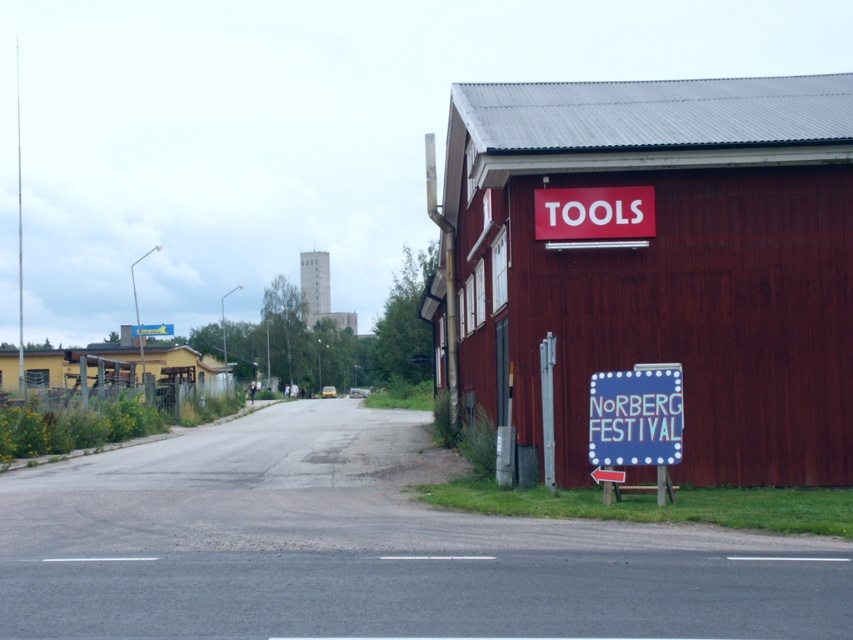
Does yellow wood barn at left have a smaller size compared to blue fabric sign at lower right?

No.

Which of these two, yellow wood barn at left or blue fabric sign at lower right, stands shorter?

With less height is blue fabric sign at lower right.

Does point (196, 360) come farther from viewer compared to point (602, 445)?

That is True.

What are the coordinates of `yellow wood barn at left` in the screenshot? It's located at (129, 372).

Does blue fabric sign at lower right have a lesser width compared to red matte tools at upper right?

Correct, blue fabric sign at lower right's width is less than red matte tools at upper right's.

Can you confirm if blue fabric sign at lower right is smaller than red matte tools at upper right?

No.

Which is in front, point (630, 429) or point (646, 221)?

Point (630, 429) is more forward.

Image resolution: width=853 pixels, height=640 pixels. Find the location of `blue fabric sign at lower right`. blue fabric sign at lower right is located at coordinates (637, 419).

Which is more to the left, red wood barn at right or red matte tools at upper right?

red wood barn at right is more to the left.

Is red wood barn at right above red matte tools at upper right?

Indeed, red wood barn at right is positioned over red matte tools at upper right.

Who is more forward, (804, 113) or (550, 205)?

Point (550, 205) is in front.

Locate an element on the screen. Image resolution: width=853 pixels, height=640 pixels. red wood barn at right is located at coordinates (659, 266).